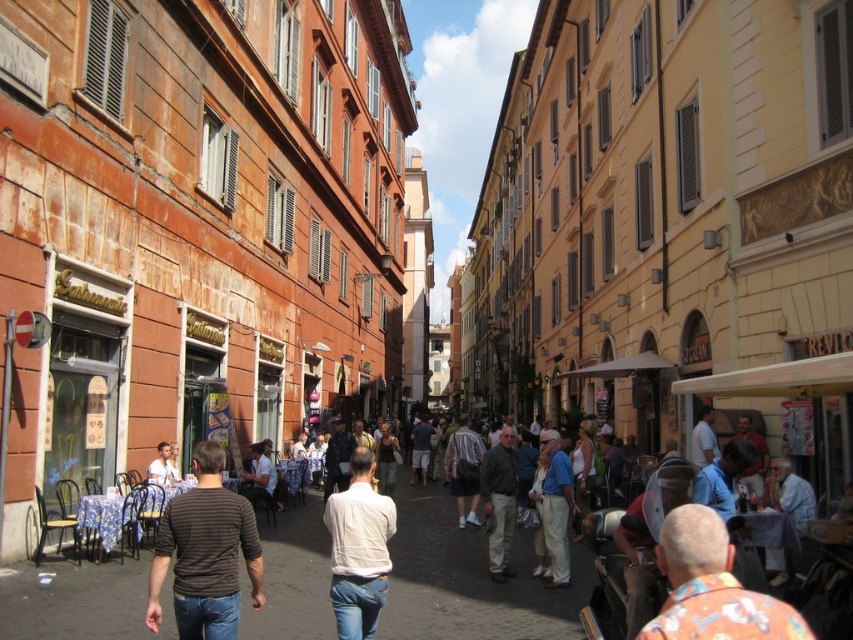
Is floral shirt at lower right to the right of white matte shirt at center from the viewer's perspective?

Yes, floral shirt at lower right is to the right of white matte shirt at center.

Who is shorter, floral shirt at lower right or white matte shirt at center?

Standing shorter between the two is floral shirt at lower right.

Which is behind, point (685, 540) or point (386, 506)?

The point (386, 506) is more distant.

At what (x,y) coordinates should I click in order to perform the action: click on floral shirt at lower right. Please return your answer as a coordinate pair (x, y). This screenshot has width=853, height=640. Looking at the image, I should click on (712, 586).

This screenshot has width=853, height=640. Find the location of `floral shirt at lower right`. floral shirt at lower right is located at coordinates (712, 586).

What do you see at coordinates (712, 586) in the screenshot? This screenshot has width=853, height=640. I see `floral shirt at lower right` at bounding box center [712, 586].

Which is in front, point (712, 618) or point (486, 502)?

Point (712, 618) is more forward.

Find the location of a particular element. floral shirt at lower right is located at coordinates (712, 586).

From the picture: Who is positioned more to the right, striped cotton shirt at center or white cotton shirt at center?

white cotton shirt at center is more to the right.

Does point (219, 448) come behind point (546, 451)?

That is False.

This screenshot has height=640, width=853. I want to click on striped cotton shirt at center, so click(x=206, y=554).

The width and height of the screenshot is (853, 640). In order to click on striped cotton shirt at center in this screenshot , I will do `click(206, 554)`.